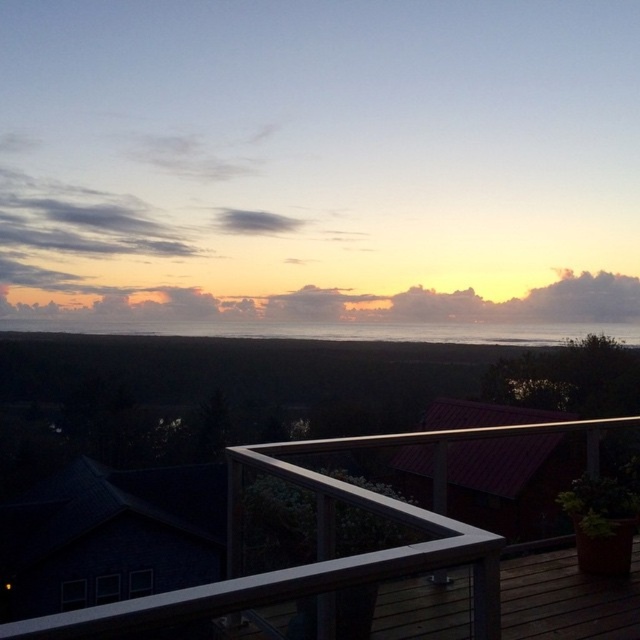
You are standing on the deck and see two points marked in the image. Which point is closer to you, point (368,504) or point (596,330)?

Point (368,504) is in front of point (596,330), so it is closer to you.

You are a delivery drone with a wingspan of 1.5 meters. You need to pass between the white glass railing at upper center and the wooden deck railing on the left. Can you fit through the space between them?

The distance between the white glass railing at upper center and the wooden deck railing on the left is 1.80 meters. Since your wingspan is 1.5 meters, you can safely pass through the space between them as there is enough clearance.

From the picture: You are standing on the deck and want to take a photo of the silvery reflective water at center. To avoid the white glass railing at upper center from blocking the view, should you move forward or backward?

The white glass railing at upper center is closer to the viewer than the silvery reflective water at center. To avoid blocking the view, you should move forward to get closer to the silvery reflective water at center and farther from the railing.